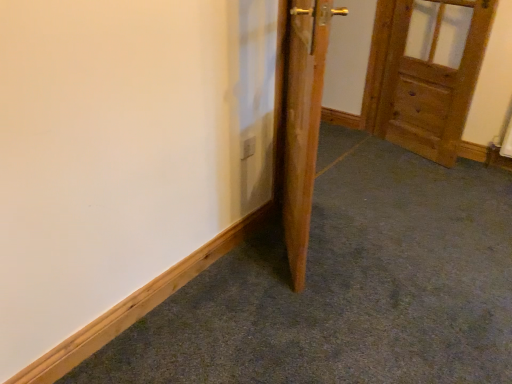
Question: Is wooden door at center, acting as the 2th door starting from the back, positioned with its back to wooden door at upper right, the 1th door from the right?

Choices:
 (A) no
 (B) yes

Answer: (A)

Question: Can you see wooden door at center, which appears as the 1th door when viewed from the front, touching wooden door at upper right, which ranks as the 2th door in left-to-right order?

Choices:
 (A) no
 (B) yes

Answer: (A)

Question: Is wooden door at center, which is the second door from right to left, at the left side of wooden door at upper right, the 1th door viewed from the back?

Choices:
 (A) no
 (B) yes

Answer: (B)

Question: Can you confirm if wooden door at center, acting as the 2th door starting from the back, is smaller than wooden door at upper right, acting as the second door starting from the front?

Choices:
 (A) yes
 (B) no

Answer: (B)

Question: Does wooden door at center, which is the 1th door in left-to-right order, have a greater width compared to wooden door at upper right, which ranks as the 2th door in left-to-right order?

Choices:
 (A) yes
 (B) no

Answer: (A)

Question: Is wooden door at center, which is the 1th door in left-to-right order, thinner than wooden door at upper right, the 1th door viewed from the back?

Choices:
 (A) no
 (B) yes

Answer: (A)

Question: Is wooden door at upper right, the 1th door from the right, oriented away from wooden door at center, which is the 1th door in left-to-right order?

Choices:
 (A) yes
 (B) no

Answer: (B)

Question: Is wooden door at upper right, the 1th door from the right, outside of wooden door at center, which appears as the 1th door when viewed from the front?

Choices:
 (A) yes
 (B) no

Answer: (A)

Question: Is wooden door at upper right, acting as the second door starting from the front, wider than wooden door at center, which is the 1th door in left-to-right order?

Choices:
 (A) no
 (B) yes

Answer: (A)

Question: From a real-world perspective, is wooden door at upper right, the 1th door from the right, located higher than wooden door at center, which is the 1th door in left-to-right order?

Choices:
 (A) no
 (B) yes

Answer: (A)

Question: From the image's perspective, is wooden door at upper right, which ranks as the 2th door in left-to-right order, above wooden door at center, which is the 1th door in left-to-right order?

Choices:
 (A) no
 (B) yes

Answer: (B)

Question: Can you confirm if wooden door at upper right, acting as the second door starting from the front, is shorter than wooden door at center, acting as the 2th door starting from the back?

Choices:
 (A) yes
 (B) no

Answer: (A)

Question: Would you say wooden door at center, which appears as the 1th door when viewed from the front, is inside or outside wooden door at upper right, which ranks as the 2th door in left-to-right order?

Choices:
 (A) inside
 (B) outside

Answer: (B)